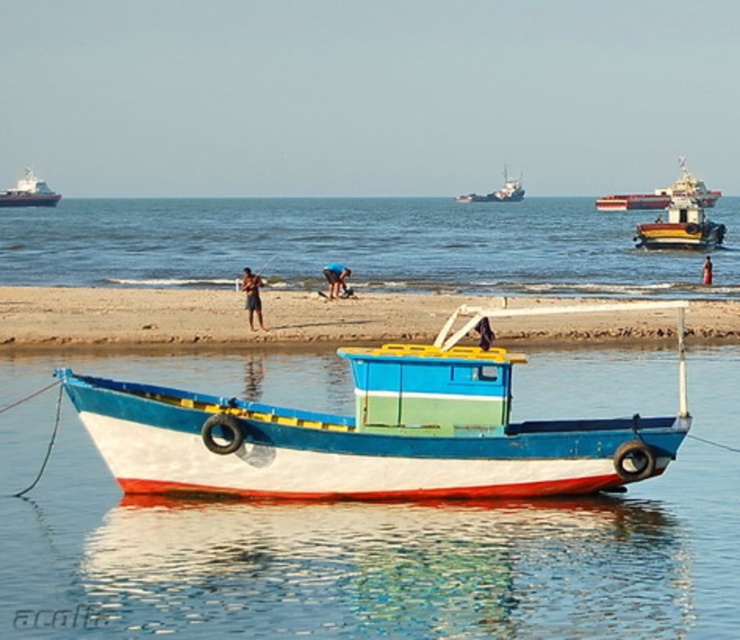
Question: Which of the following is the farthest from the observer?

Choices:
 (A) blue painted wooden boat at center
 (B) tan skin human at center
 (C) wooden polished boat at right

Answer: (A)

Question: Is blue-green water at center in front of skinny man at beach?

Choices:
 (A) no
 (B) yes

Answer: (B)

Question: Does painted wood boat at center have a larger size compared to reddish-orange metallic ship at upper right?

Choices:
 (A) yes
 (B) no

Answer: (B)

Question: Which of the following is the farthest from the observer?

Choices:
 (A) (47, 189)
 (B) (259, 276)
 (C) (44, 264)
 (D) (337, 284)

Answer: (A)

Question: In this image, where is wooden polished boat at right located relative to dark blue fabric shorts at center?

Choices:
 (A) below
 (B) above

Answer: (B)

Question: Which point is closer to the camera?

Choices:
 (A) painted wood boat at center
 (B) smooth white ship at upper left
 (C) tan skin human at center

Answer: (A)